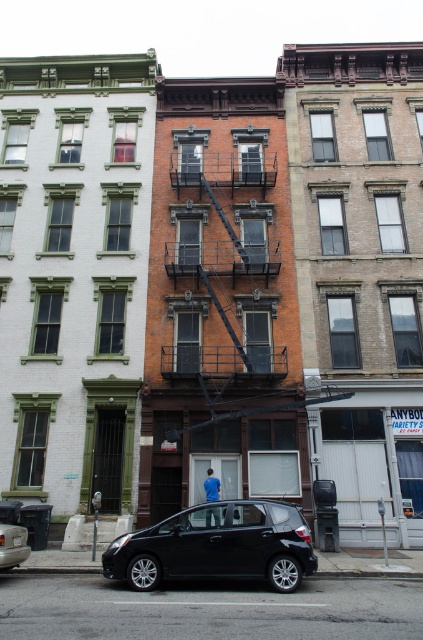
Does matte black car at lower center appear over black matte car at lower left?

Yes, matte black car at lower center is above black matte car at lower left.

Based on the photo, can you confirm if matte black car at lower center is positioned below black matte car at lower left?

No, matte black car at lower center is not below black matte car at lower left.

Where is `matte black car at lower center`? matte black car at lower center is located at coordinates (216, 547).